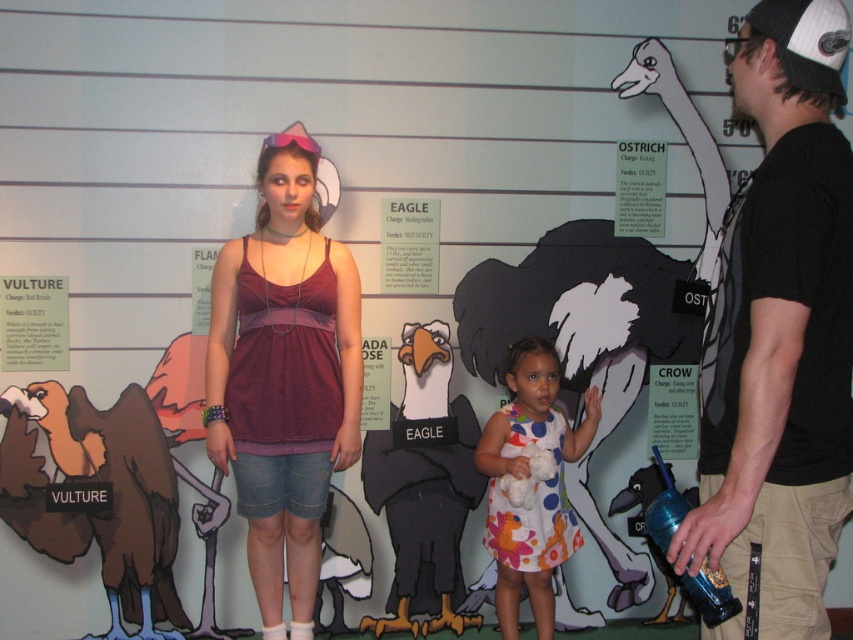
You are a photographer trying to capture a clear shot of the white fluffy ostrich at center and the white polka dot dress at center. Since the ostrich is blocking the view of the dress, can you adjust your position to see both without moving either object?

The white fluffy ostrich at center is taller than the white polka dot dress at center, so you can lower your camera angle to see the dress behind the ostrich by positioning yourself lower so the ostrich doesn work block the view of the dress.

You are a photographer trying to capture a clear shot of both the white polka dot dress at center and the white paper ostrich at upper right. Considering their sizes, which one might appear closer to the camera in the photo?

The white polka dot dress at center is larger in size than the white paper ostrich at upper right, so it would appear closer to the camera in the photo.

You are an event planner organizing a childrens party. You have both the white fluffy ostrich at center and the white polka dot dress at center available for decoration. Which item should you choose if you want something that will stand out more visually?

The white fluffy ostrich at center is larger in size than the white polka dot dress at center, so it will stand out more visually.